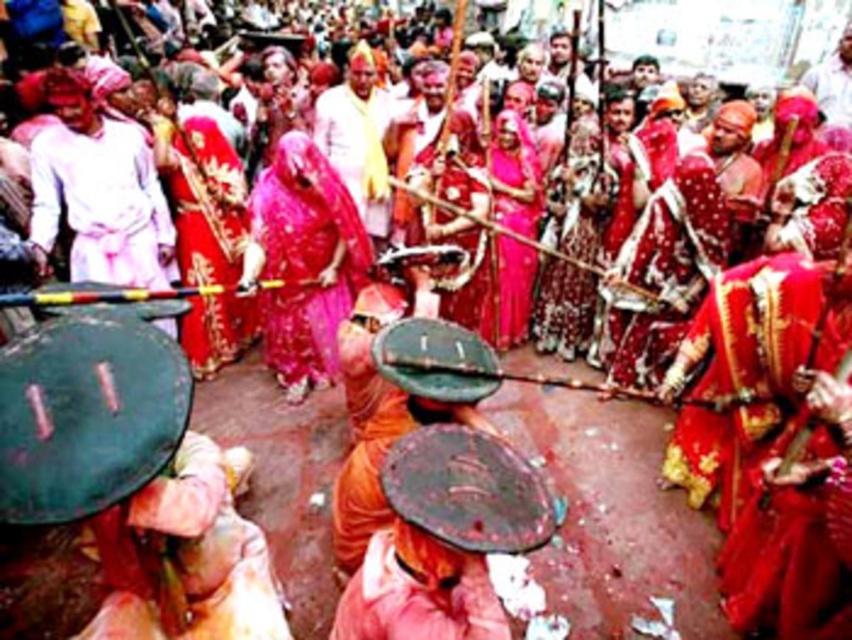
Question: Among these points, which one is farthest from the camera?

Choices:
 (A) (108, 260)
 (B) (211, 122)
 (C) (317, 220)

Answer: (B)

Question: In this image, where is white matte robe at left located relative to matte red robe at center?

Choices:
 (A) left
 (B) right

Answer: (A)

Question: Does matte pink sari at center have a greater width compared to matte yellow cloth at center?

Choices:
 (A) yes
 (B) no

Answer: (A)

Question: Which point is farther to the camera?

Choices:
 (A) (219, 202)
 (B) (277, 156)

Answer: (A)

Question: Considering the real-world distances, which object is closest to the matte pink sari at center?

Choices:
 (A) matte red robe at center
 (B) white matte robe at left
 (C) matte yellow cloth at center

Answer: (A)

Question: Observing the image, what is the correct spatial positioning of white matte robe at left in reference to matte red robe at center?

Choices:
 (A) left
 (B) right

Answer: (A)